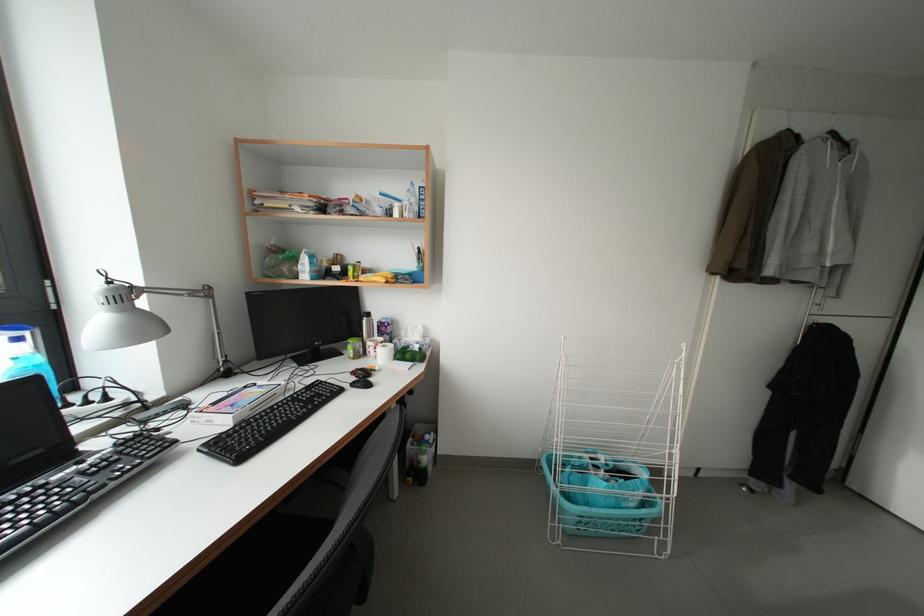
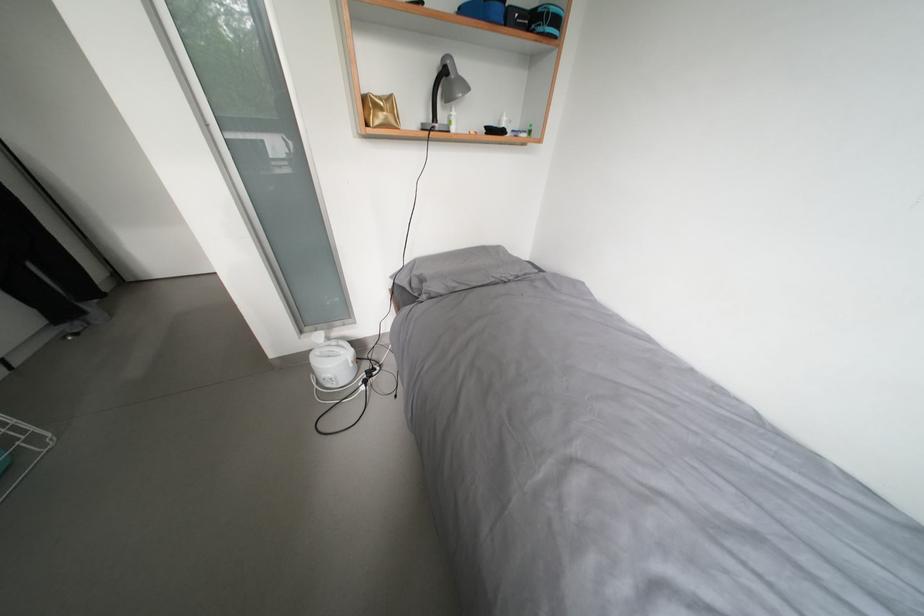
How did the camera likely rotate?

The camera's rotation is toward right-down.